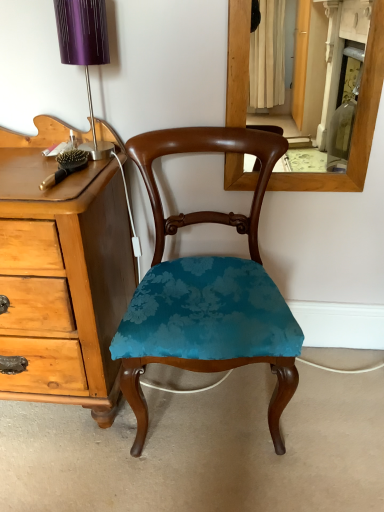
Question: From a real-world perspective, relative to purple metallic table lamp at upper left, is teal velvet chair at center vertically above or below?

Choices:
 (A) above
 (B) below

Answer: (B)

Question: Is teal velvet chair at center bigger or smaller than purple metallic table lamp at upper left?

Choices:
 (A) small
 (B) big

Answer: (B)

Question: From the image's perspective, relative to purple metallic table lamp at upper left, is teal velvet chair at center above or below?

Choices:
 (A) above
 (B) below

Answer: (B)

Question: Looking at their shapes, would you say purple metallic table lamp at upper left is wider or thinner than teal velvet chair at center?

Choices:
 (A) thin
 (B) wide

Answer: (A)

Question: From the image's perspective, is purple metallic table lamp at upper left positioned above or below teal velvet chair at center?

Choices:
 (A) above
 (B) below

Answer: (A)

Question: In the image, is purple metallic table lamp at upper left positioned in front of or behind teal velvet chair at center?

Choices:
 (A) behind
 (B) front

Answer: (A)

Question: In terms of size, does purple metallic table lamp at upper left appear bigger or smaller than teal velvet chair at center?

Choices:
 (A) small
 (B) big

Answer: (A)